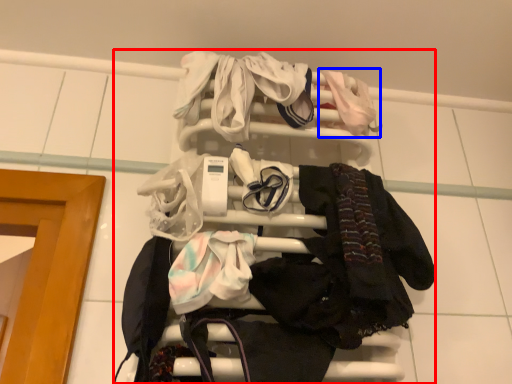
Question: Among these objects, which one is farthest to the camera, bunk bed (highlighted by a red box) or baby clothe (highlighted by a blue box)?

Choices:
 (A) bunk bed
 (B) baby clothe

Answer: (B)